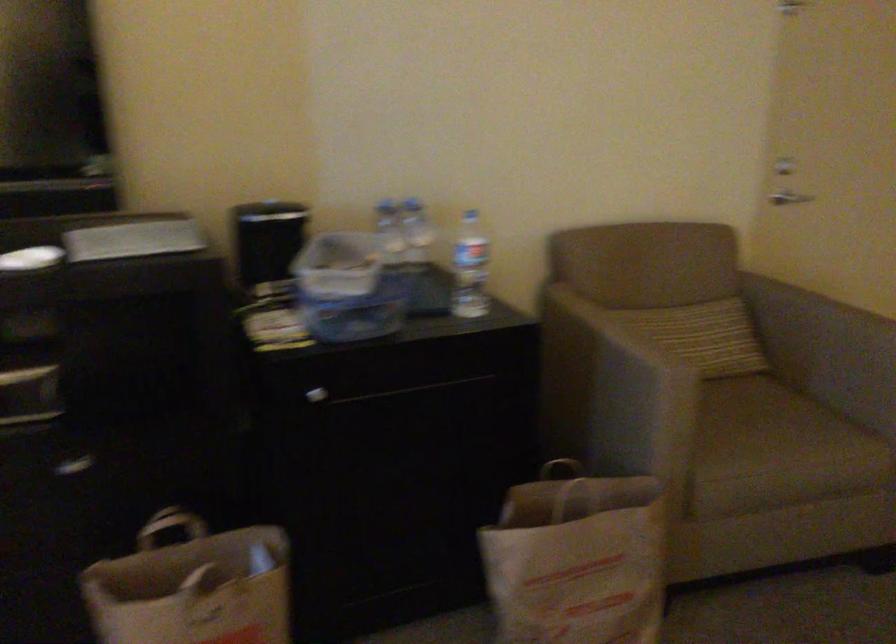
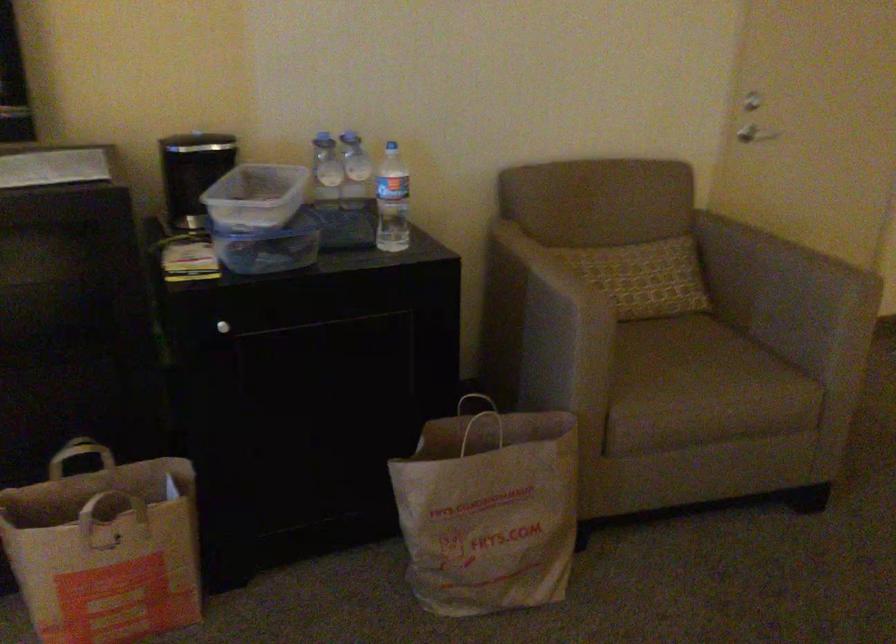
Locate, in the second image, the point that corresponds to [629,345] in the first image.

(552, 281)